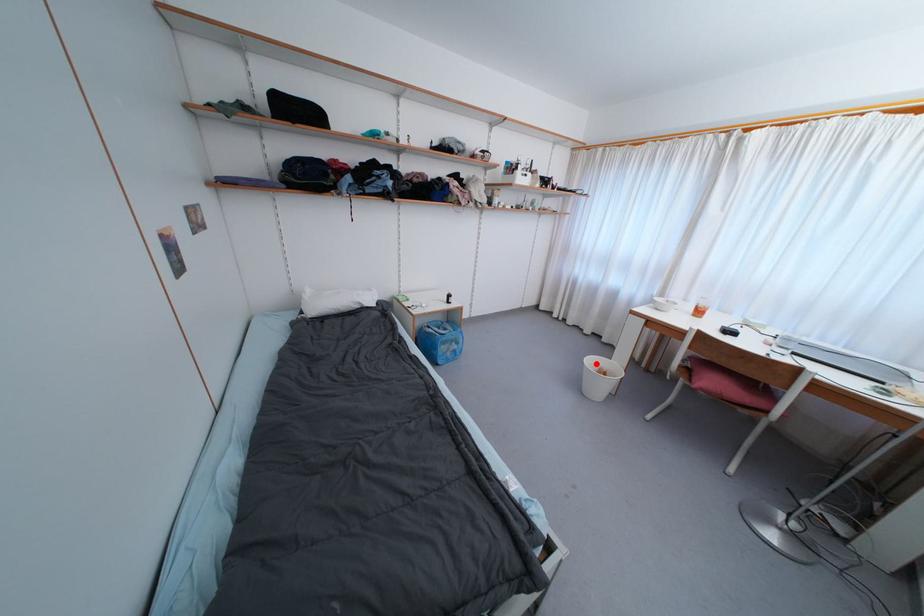
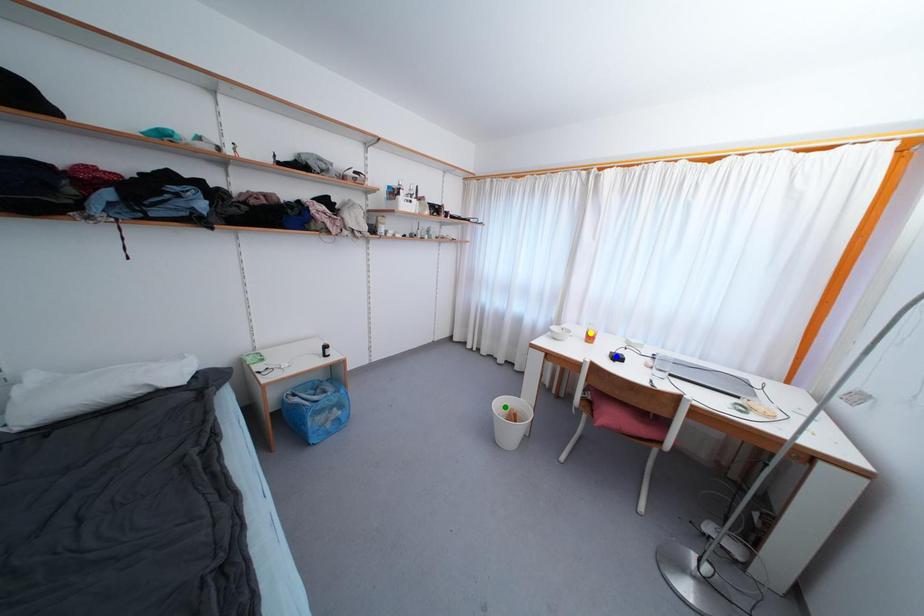
Question: I am providing you with two images of the same scene from different viewpoints. A red point is marked on the first image. You are given multiple points on the second image. In image 2, which mark is for the same physical point as the one in image 1?

Choices:
 (A) yellow point
 (B) blue point
 (C) green point

Answer: (C)